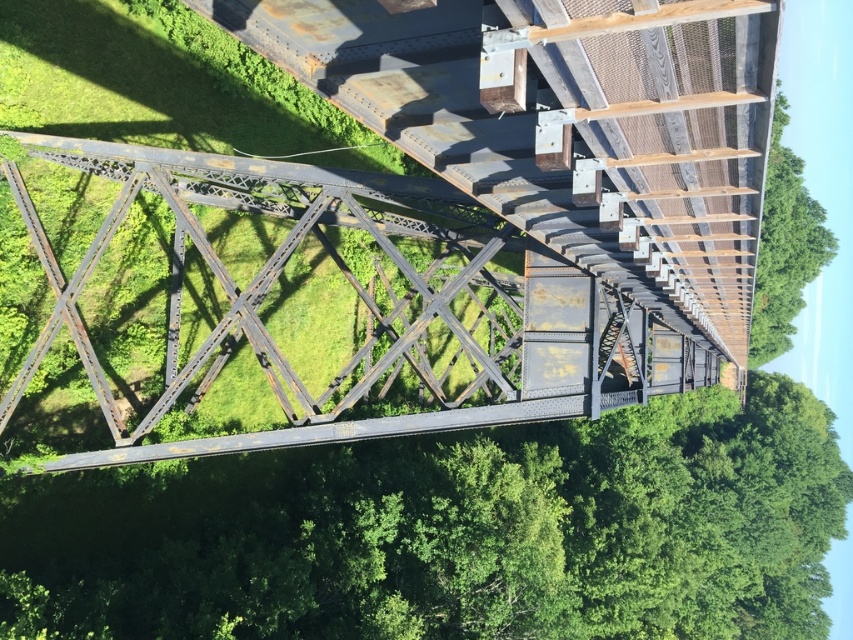
Who is lower down, rusty metal bridge at center or green leafy tree at upper right?

rusty metal bridge at center is below.

How far apart are rusty metal bridge at center and green leafy tree at upper right?

rusty metal bridge at center is 57.49 feet away from green leafy tree at upper right.

Is point (529, 275) positioned before point (776, 182)?

That is True.

Where is `rusty metal bridge at center`? The height and width of the screenshot is (640, 853). rusty metal bridge at center is located at coordinates (370, 308).

Is the position of green leafy tree at center less distant than that of rusty metal bridge at center?

No, green leafy tree at center is behind rusty metal bridge at center.

Does point (163, 504) come closer to viewer compared to point (73, 308)?

No, it is not.

Locate an element on the screen. The width and height of the screenshot is (853, 640). green leafy tree at center is located at coordinates (451, 532).

Where is `green leafy tree at center`? green leafy tree at center is located at coordinates (451, 532).

Does green leafy tree at center have a smaller size compared to green leafy tree at upper right?

No.

Can you confirm if green leafy tree at center is wider than green leafy tree at upper right?

Yes.

Measure the distance between green leafy tree at center and camera.

green leafy tree at center is 17.81 meters from camera.

Find the location of a particular element. This screenshot has width=853, height=640. green leafy tree at center is located at coordinates (451, 532).